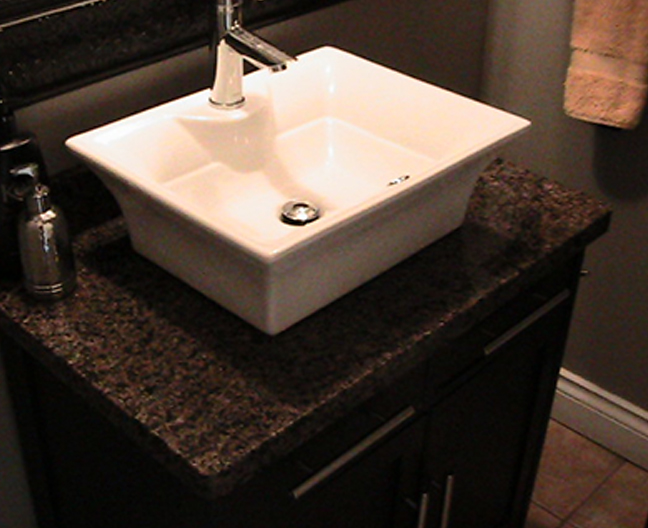
Identify the location of towel. click(x=604, y=92).